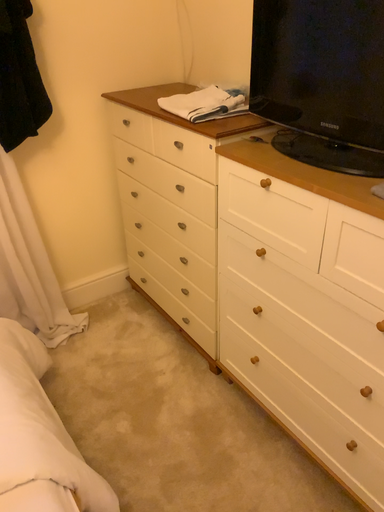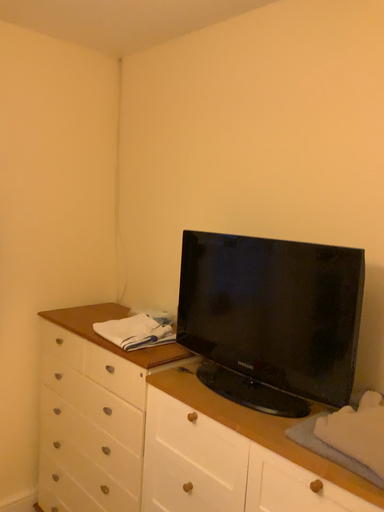
Question: How did the camera likely rotate when shooting the video?

Choices:
 (A) rotated upward
 (B) rotated downward

Answer: (A)